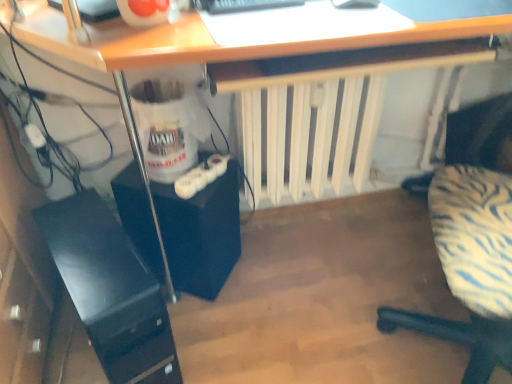
Question: Is zebra-patterned fabric chair at right facing away from white matte radiator at center?

Choices:
 (A) no
 (B) yes

Answer: (A)

Question: Would you consider zebra-patterned fabric chair at right to be distant from white matte radiator at center?

Choices:
 (A) no
 (B) yes

Answer: (A)

Question: From the image's perspective, does zebra-patterned fabric chair at right appear higher than white matte radiator at center?

Choices:
 (A) no
 (B) yes

Answer: (A)

Question: From a real-world perspective, is zebra-patterned fabric chair at right below white matte radiator at center?

Choices:
 (A) no
 (B) yes

Answer: (A)

Question: Considering the relative positions of zebra-patterned fabric chair at right and white matte radiator at center in the image provided, is zebra-patterned fabric chair at right to the right of white matte radiator at center from the viewer's perspective?

Choices:
 (A) no
 (B) yes

Answer: (B)

Question: Is white matte radiator at center a part of zebra-patterned fabric chair at right?

Choices:
 (A) no
 (B) yes

Answer: (A)

Question: Can you confirm if black glossy computer tower at lower left, which is the second computer tower from right to left, is smaller than zebra-patterned fabric chair at right?

Choices:
 (A) yes
 (B) no

Answer: (A)

Question: Can you confirm if black glossy computer tower at lower left, which is the first computer tower in left-to-right order, is thinner than zebra-patterned fabric chair at right?

Choices:
 (A) yes
 (B) no

Answer: (B)

Question: From a real-world perspective, is black glossy computer tower at lower left, which is the first computer tower in left-to-right order, physically below zebra-patterned fabric chair at right?

Choices:
 (A) yes
 (B) no

Answer: (A)

Question: Is black glossy computer tower at lower left, which is the first computer tower in left-to-right order, at the left side of zebra-patterned fabric chair at right?

Choices:
 (A) yes
 (B) no

Answer: (A)

Question: Does black glossy computer tower at lower left, which is the first computer tower in left-to-right order, have a lesser height compared to zebra-patterned fabric chair at right?

Choices:
 (A) no
 (B) yes

Answer: (B)

Question: Can you confirm if black glossy computer tower at lower left, which is the second computer tower from right to left, is positioned to the right of zebra-patterned fabric chair at right?

Choices:
 (A) yes
 (B) no

Answer: (B)

Question: Is black matte computer tower at lower left, the second computer tower in the left-to-right sequence, to the right of black glossy computer tower at lower left, which is the second computer tower from right to left, from the viewer's perspective?

Choices:
 (A) yes
 (B) no

Answer: (A)